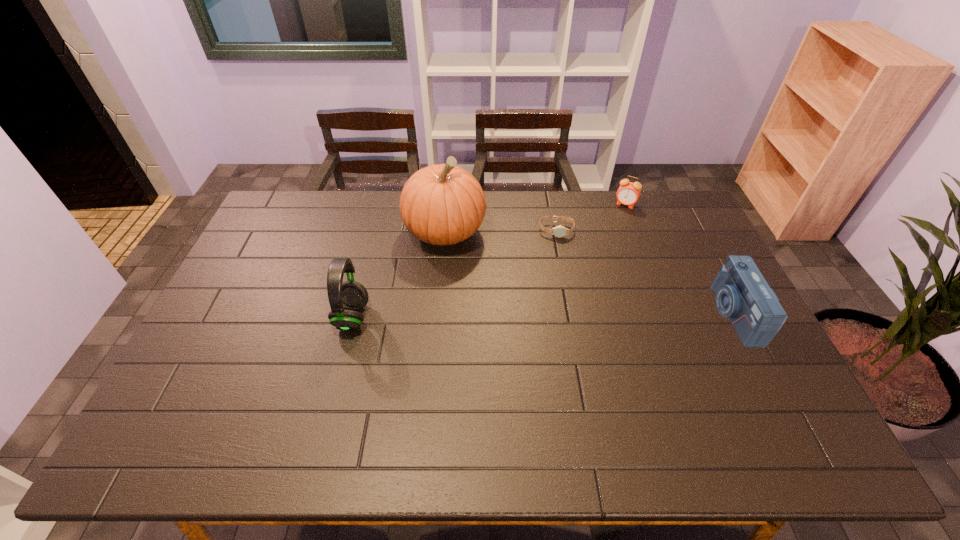
The image size is (960, 540). What are the coordinates of `the leftmost object` in the screenshot? It's located at (346, 298).

Identify the location of headset. (346, 298).

This screenshot has width=960, height=540. I want to click on the rightmost object, so click(x=743, y=295).

You are a GUI agent. You are given a task and a screenshot of the screen. Output one action in this format:
    pyautogui.click(x=<x>, y=<y>)
    Task: Click on the pumpkin
    
    Given the screenshot: What is the action you would take?
    pyautogui.click(x=443, y=204)

This screenshot has height=540, width=960. In order to click on the fourth object from right to left in this screenshot , I will do `click(443, 204)`.

Locate an element on the screen. watch is located at coordinates (560, 231).

Where is `the third object from left to right`? This screenshot has width=960, height=540. the third object from left to right is located at coordinates (560, 231).

Image resolution: width=960 pixels, height=540 pixels. I want to click on the fourth object from left to right, so click(628, 193).

You are a GUI agent. You are given a task and a screenshot of the screen. Output one action in this format:
    pyautogui.click(x=<x>, y=<y>)
    Task: Click on the second shortest object
    The width and height of the screenshot is (960, 540).
    Given the screenshot: What is the action you would take?
    pyautogui.click(x=628, y=193)

The image size is (960, 540). I want to click on vacant space located 0.240m on the ear cups of the second tallest object, so click(253, 316).